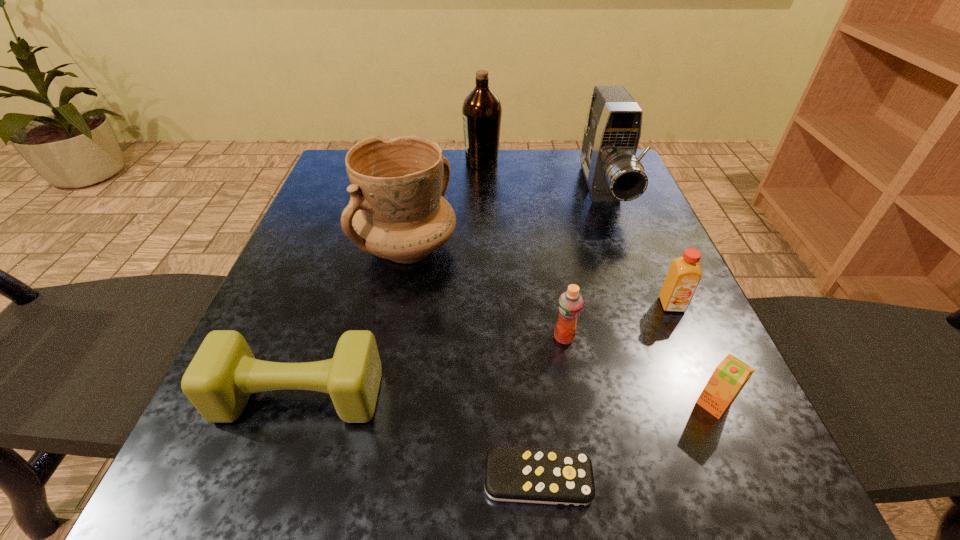
Find the location of a particular element. vacant point located between the olive oil and the leftmost orange juice is located at coordinates (523, 249).

Locate which object ranks second in proximity to the pottery. Please provide its 2D coordinates. Your answer should be formatted as a tuple, i.e. [(x, y)], where the tuple contains the x and y coordinates of a point satisfying the conditions above.

[(570, 304)]

This screenshot has width=960, height=540. What are the coordinates of `the closest object relative to the dumbbell` in the screenshot? It's located at pyautogui.click(x=563, y=477).

Locate an element on the screen. the second closest orange juice relative to the fourth nearest object is located at coordinates (728, 379).

This screenshot has height=540, width=960. In order to click on the closest orange juice relative to the dumbbell in this screenshot , I will do `click(570, 304)`.

Image resolution: width=960 pixels, height=540 pixels. Identify the location of free space that satisfies the following two spatial constraints: 1. on the front side of the nearest orange juice; 2. on the right side of the fifth farthest object. (576, 404).

Where is `vacant space that satisfies the following two spatial constraints: 1. on the label of the shortest orange juice; 2. on the left side of the olive oil`? This screenshot has height=540, width=960. vacant space that satisfies the following two spatial constraints: 1. on the label of the shortest orange juice; 2. on the left side of the olive oil is located at coordinates (483, 404).

Locate an element on the screen. The width and height of the screenshot is (960, 540). vacant position in the image that satisfies the following two spatial constraints: 1. on the label of the olive oil; 2. on the right side of the fifth farthest object is located at coordinates (483, 338).